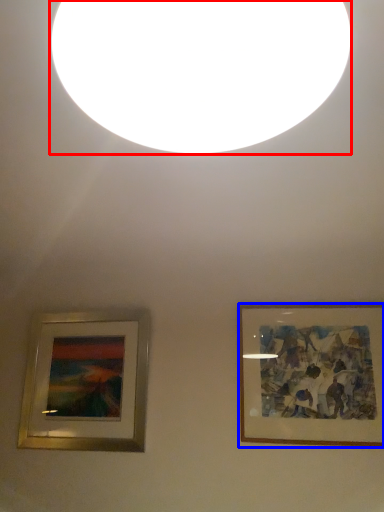
Question: Which object appears closest to the camera in this image, lighting (highlighted by a red box) or picture frame (highlighted by a blue box)?

Choices:
 (A) lighting
 (B) picture frame

Answer: (A)